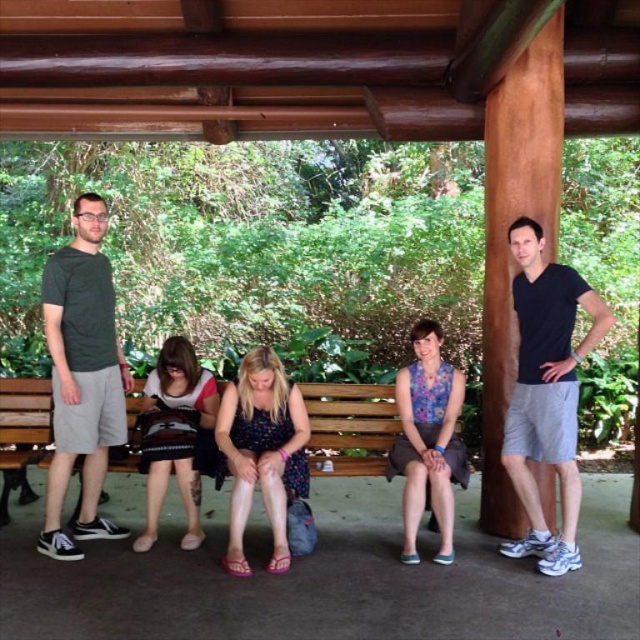
Can you confirm if matte black t-shirt at left is shorter than wooden bench at center?

Incorrect, matte black t-shirt at left's height does not fall short of wooden bench at center's.

Does point (128, 376) lie behind point (385, 387)?

That is False.

The height and width of the screenshot is (640, 640). Find the location of `matte black t-shirt at left`. matte black t-shirt at left is located at coordinates point(81,376).

Can you confirm if matte black t-shirt at left is positioned to the right of black cotton t-shirt at center?

In fact, matte black t-shirt at left is to the left of black cotton t-shirt at center.

How distant is matte black t-shirt at left from black cotton t-shirt at center?

matte black t-shirt at left is 7.38 feet away from black cotton t-shirt at center.

Find the location of a particular element. The height and width of the screenshot is (640, 640). matte black t-shirt at left is located at coordinates (81, 376).

Can you confirm if black cotton t-shirt at center is thinner than wooden bench at center?

Correct, black cotton t-shirt at center's width is less than wooden bench at center's.

Is black cotton t-shirt at center further to the viewer compared to wooden bench at center?

No, black cotton t-shirt at center is closer to the viewer.

Is point (529, 401) more distant than point (339, 433)?

No, (529, 401) is closer to viewer.

You are a GUI agent. You are given a task and a screenshot of the screen. Output one action in this format:
    pyautogui.click(x=<x>, y=<y>)
    Task: Click on the black cotton t-shirt at center
    
    Given the screenshot: What is the action you would take?
    547,392